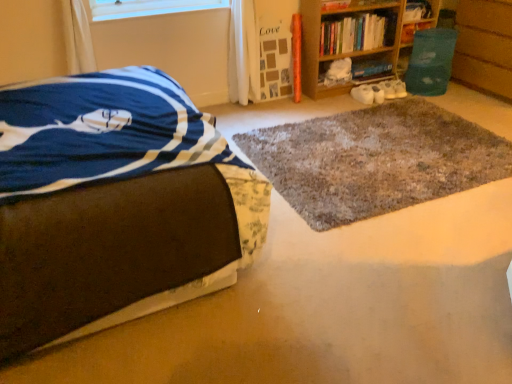
You are a GUI agent. You are given a task and a screenshot of the screen. Output one action in this format:
    pyautogui.click(x=<x>, y=<y>)
    Task: Click on the spots to the right of brown fabric bed at left
    This screenshot has width=512, height=384.
    Given the screenshot: What is the action you would take?
    pyautogui.click(x=374, y=276)